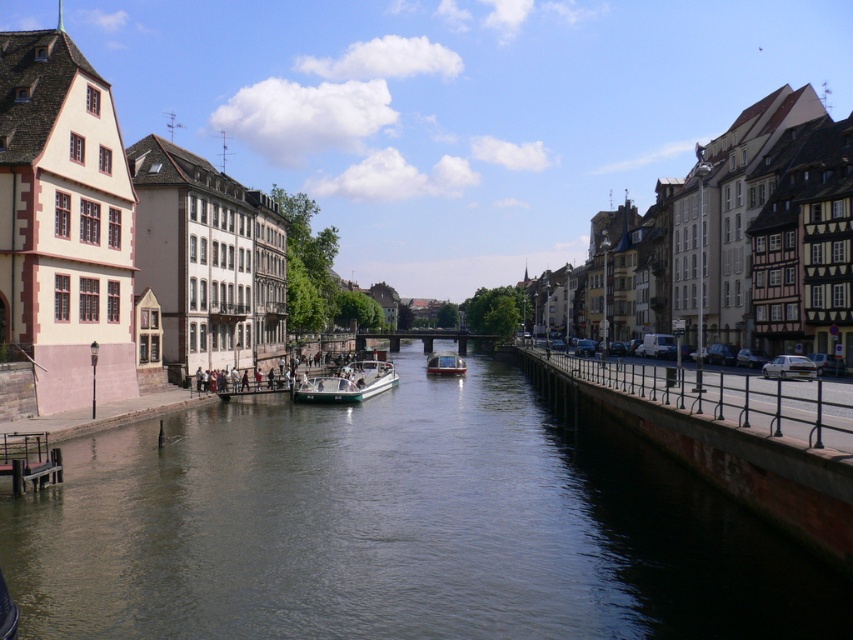
You are standing at the origin point of the coordinate system, which is the bottom left corner of the image. A green matte boat at center is located at coordinate point (347, 384). If you want to move towards the green matte boat at center, in which direction should you move?

You should move towards the northeast direction to reach the green matte boat at center located at coordinate point (347, 384).